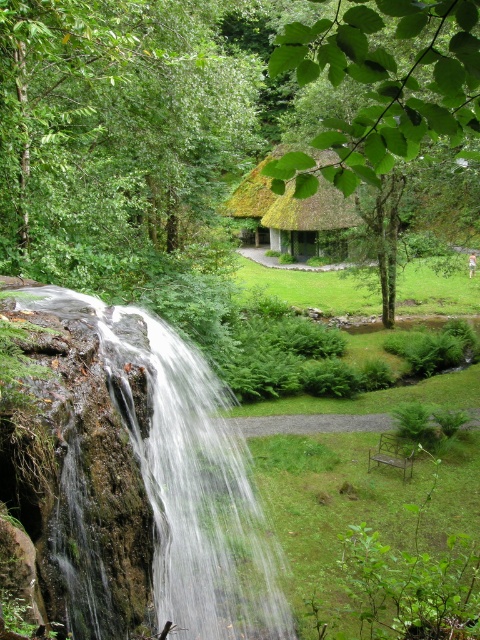
Question: Considering the relative positions of green leafy tree at upper left and thatched roof hut at center in the image provided, where is green leafy tree at upper left located with respect to thatched roof hut at center?

Choices:
 (A) right
 (B) left

Answer: (B)

Question: Can you confirm if clear water at center is positioned to the left of thatched roof hut at center?

Choices:
 (A) yes
 (B) no

Answer: (A)

Question: Is clear water at center bigger than green leafy tree at upper center?

Choices:
 (A) yes
 (B) no

Answer: (B)

Question: Which point is farther to the camera?

Choices:
 (A) green leafy tree at upper center
 (B) clear water at center
 (C) green leafy tree at upper left
 (D) thatched roof hut at center

Answer: (D)

Question: Which is nearer to the green leafy tree at upper center?

Choices:
 (A) clear water at center
 (B) green leafy tree at upper left
 (C) thatched roof hut at center

Answer: (B)

Question: Which object is closer to the camera taking this photo?

Choices:
 (A) clear water at center
 (B) green leafy tree at upper center

Answer: (B)